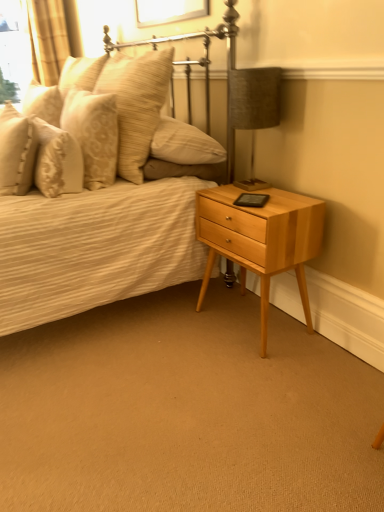
Question: From the image's perspective, does light wood/finely finished nightstand at lower right appear higher than soft beige pillow at upper left, which is the first pillow from right to left?

Choices:
 (A) yes
 (B) no

Answer: (B)

Question: Considering the relative positions of light wood/finely finished nightstand at lower right and soft beige pillow at upper left, positioned as the fourth pillow in left-to-right order, in the image provided, is light wood/finely finished nightstand at lower right to the left of soft beige pillow at upper left, positioned as the fourth pillow in left-to-right order, from the viewer's perspective?

Choices:
 (A) yes
 (B) no

Answer: (B)

Question: Is light wood/finely finished nightstand at lower right not within soft beige pillow at upper left, positioned as the fourth pillow in left-to-right order?

Choices:
 (A) no
 (B) yes

Answer: (B)

Question: Does light wood/finely finished nightstand at lower right have a smaller size compared to soft beige pillow at upper left, positioned as the fourth pillow in left-to-right order?

Choices:
 (A) no
 (B) yes

Answer: (B)

Question: Does light wood/finely finished nightstand at lower right have a greater height compared to soft beige pillow at upper left, which is the first pillow from right to left?

Choices:
 (A) no
 (B) yes

Answer: (B)

Question: Considering the positions of soft beige pillow at upper left, which is the first pillow from right to left, and matte beige bed at center in the image, is soft beige pillow at upper left, which is the first pillow from right to left, wider or thinner than matte beige bed at center?

Choices:
 (A) thin
 (B) wide

Answer: (A)

Question: From the image's perspective, relative to matte beige bed at center, is soft beige pillow at upper left, which is the first pillow from right to left, above or below?

Choices:
 (A) above
 (B) below

Answer: (A)

Question: Is soft beige pillow at upper left, positioned as the fourth pillow in left-to-right order, situated inside matte beige bed at center or outside?

Choices:
 (A) inside
 (B) outside

Answer: (A)

Question: Relative to matte beige bed at center, is soft beige pillow at upper left, which is the first pillow from right to left, in front or behind?

Choices:
 (A) front
 (B) behind

Answer: (B)

Question: Considering the positions of golden textured curtain at upper left and beige textured pillow at left, acting as the 2th pillow starting from the left, in the image, is golden textured curtain at upper left bigger or smaller than beige textured pillow at left, acting as the 2th pillow starting from the left,?

Choices:
 (A) small
 (B) big

Answer: (B)

Question: In the image, is golden textured curtain at upper left on the left side or the right side of beige textured pillow at left, which appears as the third pillow when viewed from the right?

Choices:
 (A) left
 (B) right

Answer: (A)

Question: Is golden textured curtain at upper left taller or shorter than beige textured pillow at left, which appears as the third pillow when viewed from the right?

Choices:
 (A) short
 (B) tall

Answer: (B)

Question: From a real-world perspective, is golden textured curtain at upper left above or below beige textured pillow at left, which appears as the third pillow when viewed from the right?

Choices:
 (A) above
 (B) below

Answer: (A)

Question: In terms of size, does textured fabric lampshade at upper right appear bigger or smaller than matte beige bed at center?

Choices:
 (A) big
 (B) small

Answer: (B)

Question: Considering the positions of textured fabric lampshade at upper right and matte beige bed at center in the image, is textured fabric lampshade at upper right taller or shorter than matte beige bed at center?

Choices:
 (A) tall
 (B) short

Answer: (B)